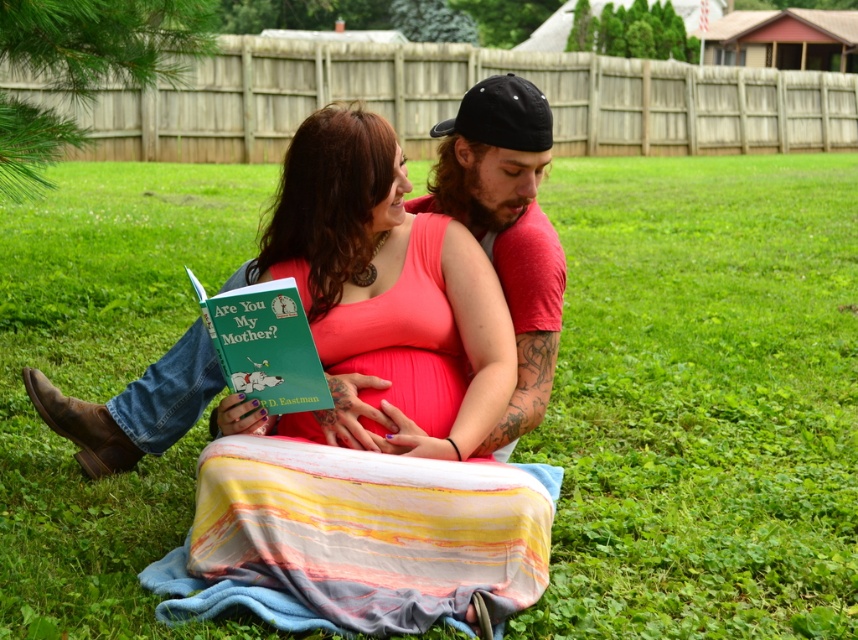
You are a photographer taking a picture of the scene. You notice the pink fabric at center and the green matte book at center. Which object should you focus on if you want to capture the wider object in your shot?

The pink fabric at center is wider than the green matte book at center, so you should focus on the pink fabric at center to capture the wider object in your shot.

You are a photographer planning to take a closeup shot of the pink fabric at center and the smooth pink skin at center. Which object should you focus on first if you want to capture both in focus without moving the camera? Explain your reasoning based on their positions.

The pink fabric at center is above the smooth pink skin at center. To capture both in focus, you should focus on the pink fabric at center first since it is closer to the camera, allowing the smooth pink skin at center to be within the depth of field.

You are a photographer capturing this moment. You need to ensure both the pink fabric at center and the smooth pink skin at center are visible in the frame. Given their sizes, which object should you focus on to make sure both are in the shot?

The pink fabric at center is bigger than the smooth pink skin at center. To ensure both are visible, focus on the pink fabric at center since it is larger and can help frame the composition around it while including the smaller smooth pink skin at center.